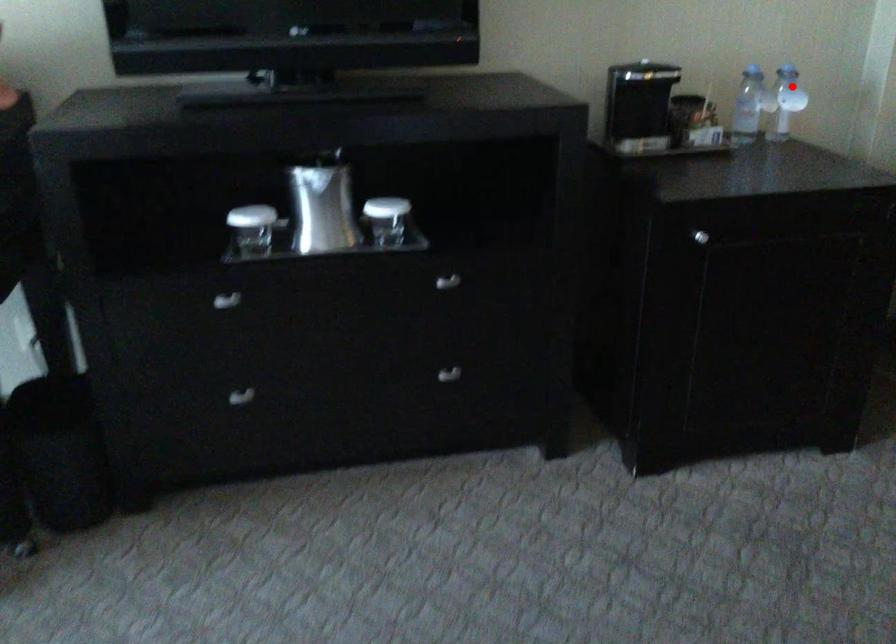
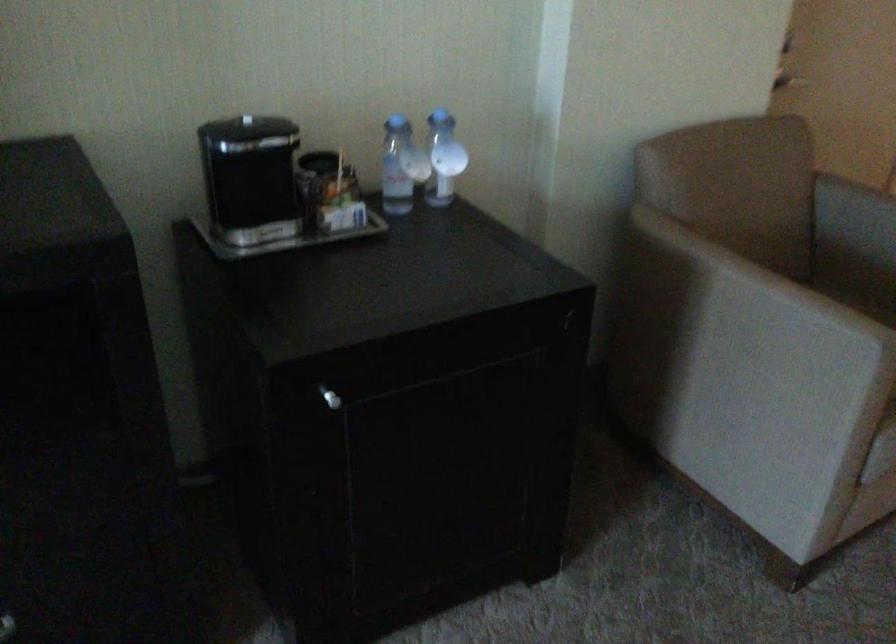
Question: I am providing you with two images of the same scene from different viewpoints. In image1, a red point is highlighted. Considering the same 3D point in image2, which of the following is correct?

Choices:
 (A) It is closer
 (B) It is farther

Answer: (A)